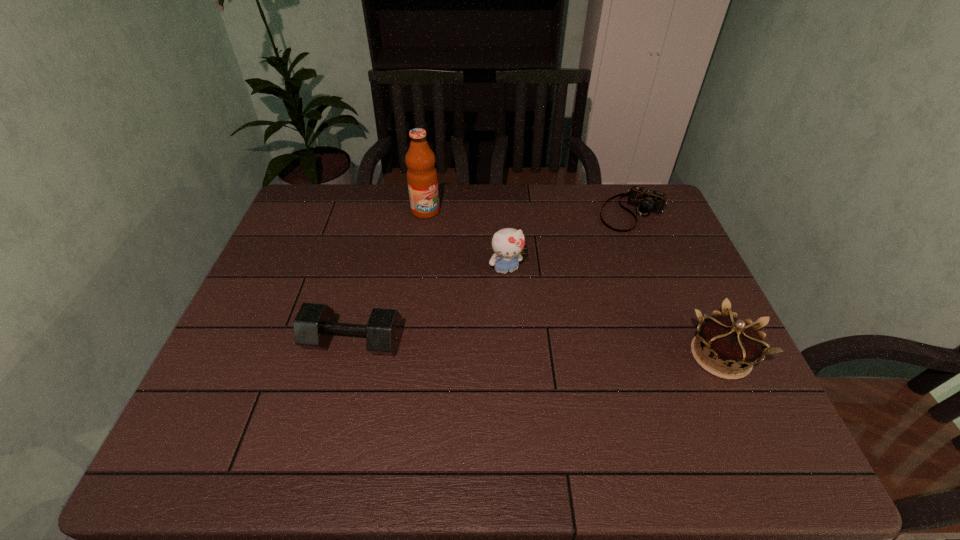
Where is `crown that is at the right edge`? crown that is at the right edge is located at coordinates (726, 341).

Where is `camera at the right edge`? Image resolution: width=960 pixels, height=540 pixels. camera at the right edge is located at coordinates pos(645,200).

The height and width of the screenshot is (540, 960). In order to click on object positioned at the far right corner in this screenshot , I will do `click(645, 200)`.

Image resolution: width=960 pixels, height=540 pixels. I want to click on object present at the near right corner, so click(726, 341).

Identify the location of vacant space at the far edge of the desktop. This screenshot has height=540, width=960. (614, 219).

Where is `vacant area at the near edge of the desktop`? The height and width of the screenshot is (540, 960). vacant area at the near edge of the desktop is located at coordinates (469, 385).

In the image, there is a desktop. At what (x,y) coordinates should I click in order to perform the action: click on free region at the left edge. Please return your answer as a coordinate pair (x, y). This screenshot has height=540, width=960. Looking at the image, I should click on (251, 378).

Where is `free space at the right edge`? free space at the right edge is located at coordinates (665, 296).

At what (x,y) coordinates should I click in order to perform the action: click on free space at the near left corner. Please return your answer as a coordinate pair (x, y). The image size is (960, 540). Looking at the image, I should click on (245, 394).

Identify the location of vacant space in between the shortest object and the third object from left to right. (569, 241).